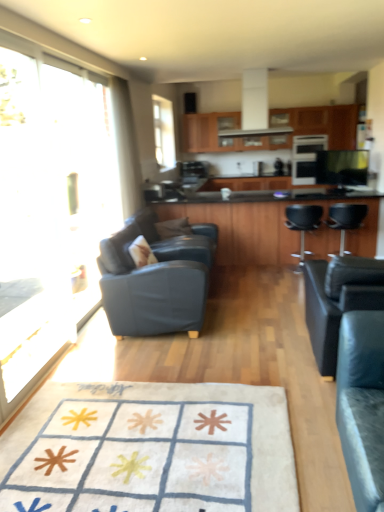
Question: Can you confirm if transparent glass door at left is shorter than wooden cabinets at upper center?

Choices:
 (A) no
 (B) yes

Answer: (A)

Question: Is transparent glass door at left closer to camera compared to wooden cabinets at upper center?

Choices:
 (A) no
 (B) yes

Answer: (B)

Question: Is transparent glass door at left wider than wooden cabinets at upper center?

Choices:
 (A) yes
 (B) no

Answer: (B)

Question: Does transparent glass door at left appear on the right side of wooden cabinets at upper center?

Choices:
 (A) no
 (B) yes

Answer: (A)

Question: Can you confirm if transparent glass door at left is thinner than wooden cabinets at upper center?

Choices:
 (A) no
 (B) yes

Answer: (B)

Question: Is transparent glass door at left located outside wooden cabinets at upper center?

Choices:
 (A) no
 (B) yes

Answer: (B)

Question: Can you confirm if black leather chair at right, the 1th chair viewed from the right, is bigger than white glossy exhaust hood at upper center?

Choices:
 (A) no
 (B) yes

Answer: (A)

Question: Is black leather chair at right, which is counted as the fourth chair, starting from the left, not within white glossy exhaust hood at upper center?

Choices:
 (A) no
 (B) yes

Answer: (B)

Question: Does black leather chair at right, the 1th chair viewed from the right, have a lesser width compared to white glossy exhaust hood at upper center?

Choices:
 (A) no
 (B) yes

Answer: (B)

Question: Is black leather chair at right, the 1th chair viewed from the right, smaller than white glossy exhaust hood at upper center?

Choices:
 (A) no
 (B) yes

Answer: (B)

Question: Is black leather chair at right, which is counted as the fourth chair, starting from the left, looking in the opposite direction of white glossy exhaust hood at upper center?

Choices:
 (A) no
 (B) yes

Answer: (A)

Question: Is transparent glass window at upper center taller than black glossy tv at upper right, which is counted as the 1th appliance, starting from the front?

Choices:
 (A) yes
 (B) no

Answer: (A)